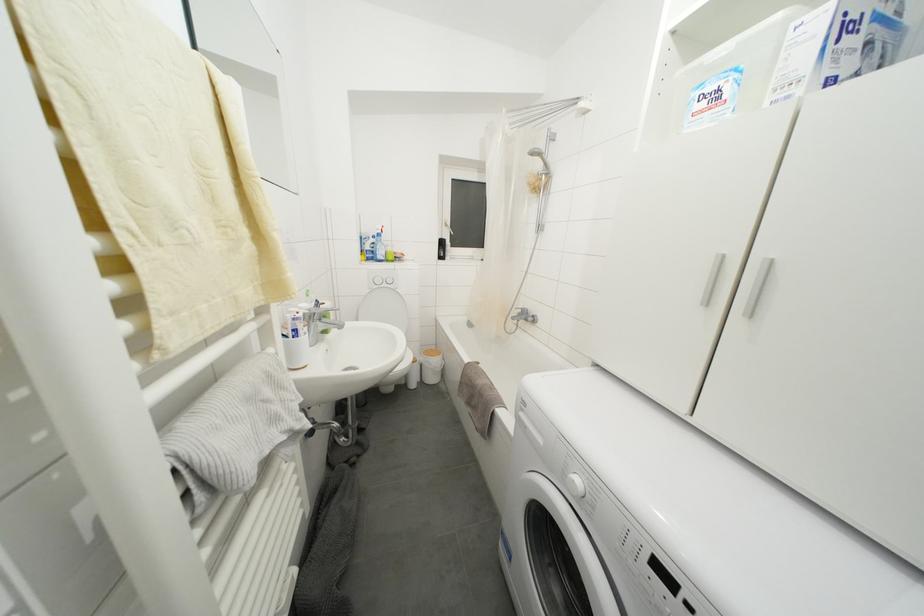
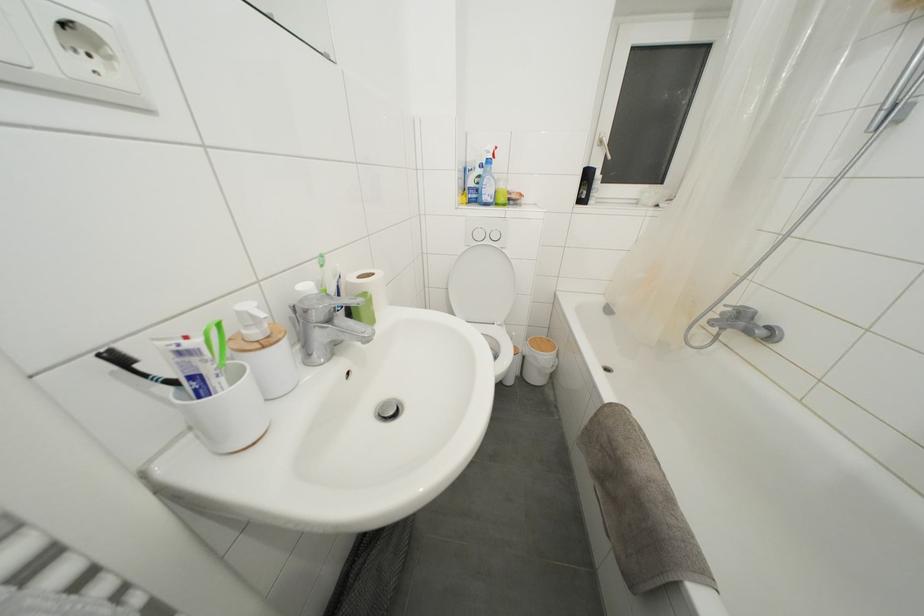
Find the pixel in the second image that matches (445,248) in the first image.

(591, 180)